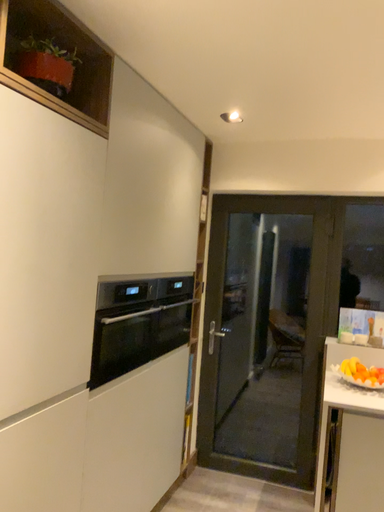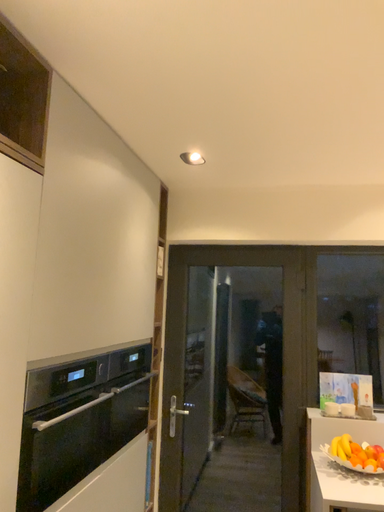
Question: How did the camera likely rotate when shooting the video?

Choices:
 (A) rotated downward
 (B) rotated upward

Answer: (B)